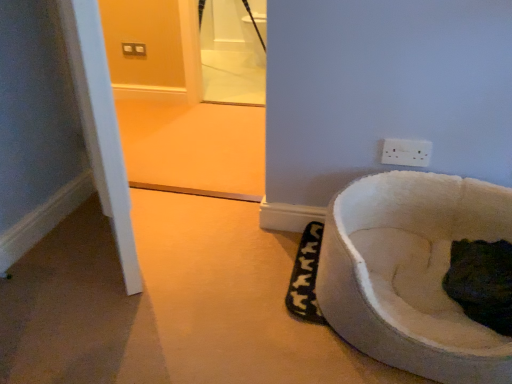
Question: Is point (481, 244) positioned closer to the camera than point (419, 157)?

Choices:
 (A) closer
 (B) farther

Answer: (A)

Question: In the image, is dark fur cat at lower right on the left side or the right side of white plastic power plugs and sockets at upper right?

Choices:
 (A) left
 (B) right

Answer: (B)

Question: Which object is positioned closest to the white plastic power plugs and sockets at upper right?

Choices:
 (A) white soft pet bed at lower right
 (B) dark fur cat at lower right

Answer: (A)

Question: Which of these objects is positioned farthest from the dark fur cat at lower right?

Choices:
 (A) white plastic power plugs and sockets at upper right
 (B) white soft pet bed at lower right

Answer: (A)